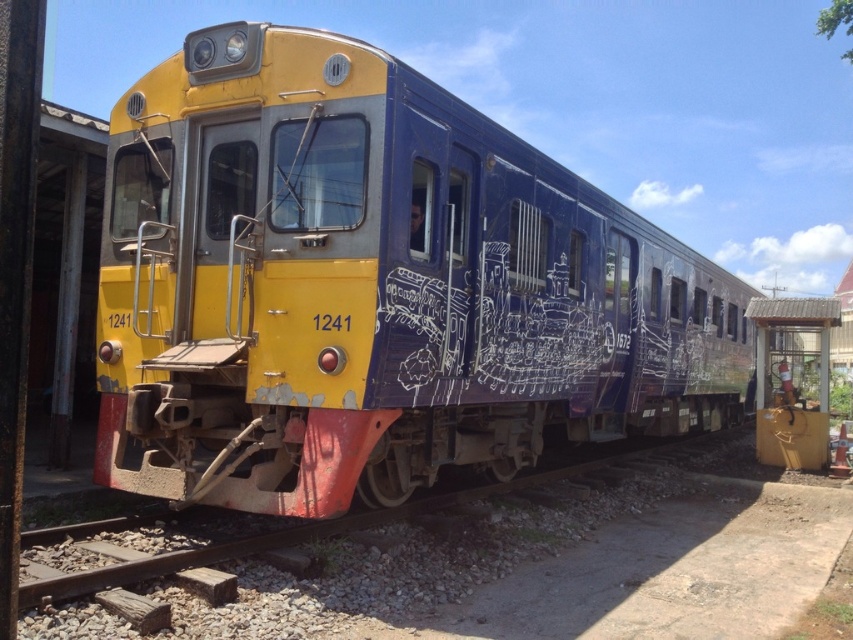
Is yellow matte train at center shorter than metal/rough track at lower left?

No.

Can you confirm if yellow matte train at center is bigger than metal/rough track at lower left?

Yes, yellow matte train at center is bigger than metal/rough track at lower left.

Describe the element at coordinates (373, 285) in the screenshot. I see `yellow matte train at center` at that location.

What are the coordinates of `yellow matte train at center` in the screenshot? It's located at (373, 285).